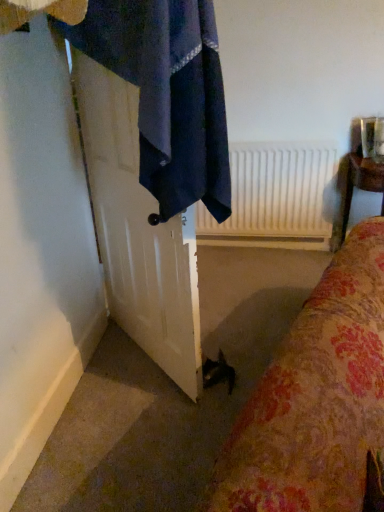
Question: Does dark blue fabric towel at upper left have a greater height compared to white glossy door at left?

Choices:
 (A) yes
 (B) no

Answer: (B)

Question: Is dark blue fabric towel at upper left closer to the viewer compared to white glossy door at left?

Choices:
 (A) yes
 (B) no

Answer: (A)

Question: Is dark blue fabric towel at upper left far away from white glossy door at left?

Choices:
 (A) no
 (B) yes

Answer: (A)

Question: Does dark blue fabric towel at upper left appear on the right side of white glossy door at left?

Choices:
 (A) yes
 (B) no

Answer: (A)

Question: Can you confirm if dark blue fabric towel at upper left is wider than white glossy door at left?

Choices:
 (A) no
 (B) yes

Answer: (B)

Question: Is dark blue fabric towel at upper left outside of white glossy door at left?

Choices:
 (A) yes
 (B) no

Answer: (A)

Question: From the image's perspective, is wooden chair at right located beneath white glossy door at left?

Choices:
 (A) no
 (B) yes

Answer: (A)

Question: Does wooden chair at right have a lesser width compared to white glossy door at left?

Choices:
 (A) no
 (B) yes

Answer: (A)

Question: Can you confirm if wooden chair at right is positioned to the left of white glossy door at left?

Choices:
 (A) yes
 (B) no

Answer: (B)

Question: Is wooden chair at right wider than white glossy door at left?

Choices:
 (A) no
 (B) yes

Answer: (B)

Question: Can you confirm if wooden chair at right is shorter than white glossy door at left?

Choices:
 (A) yes
 (B) no

Answer: (A)

Question: Is wooden chair at right at the right side of white glossy door at left?

Choices:
 (A) no
 (B) yes

Answer: (B)

Question: From the image's perspective, is white matte radiator at upper center under white glossy door at left?

Choices:
 (A) no
 (B) yes

Answer: (A)